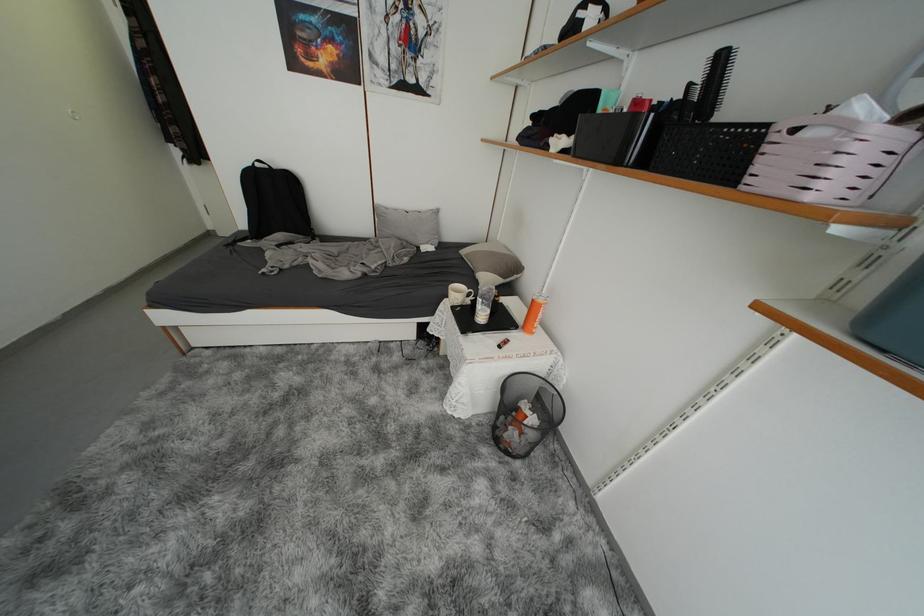
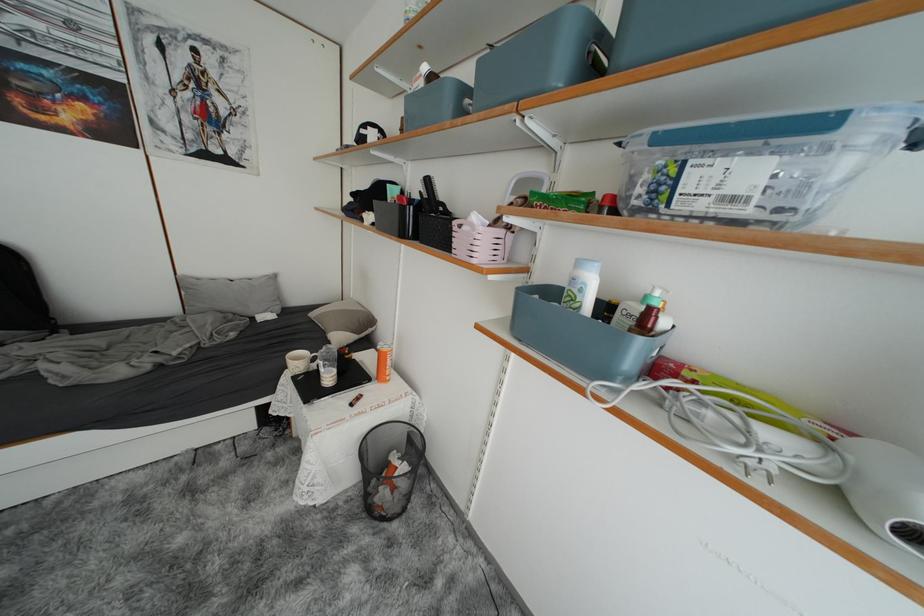
In the second image, find the point that corresponds to (541,301) in the first image.

(385, 351)